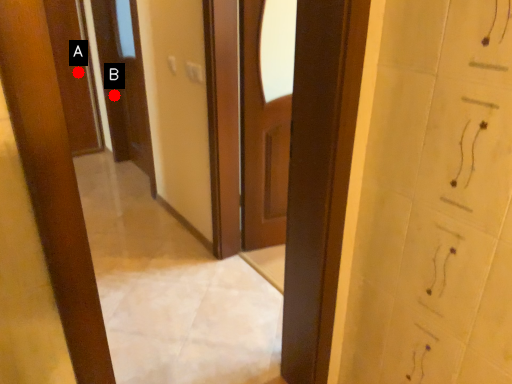
Question: Two points are circled on the image, labeled by A and B beside each circle. Which point is closer to the camera?

Choices:
 (A) A is closer
 (B) B is closer

Answer: (B)